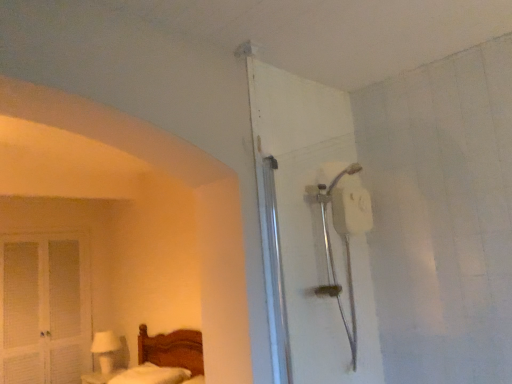
Question: From the image's perspective, is white louvered screen door at left positioned above or below white glossy table lamp at lower left?

Choices:
 (A) above
 (B) below

Answer: (A)

Question: Is point [72, 347] positioned closer to the camera than point [117, 337]?

Choices:
 (A) closer
 (B) farther

Answer: (A)

Question: Considering the real-world distances, which object is farthest from the white matte shower head at upper right?

Choices:
 (A) white louvered screen door at left
 (B) white glossy table lamp at lower left
 (C) white fluffy mattress at lower left

Answer: (B)

Question: Considering the real-world distances, which object is farthest from the white louvered screen door at left?

Choices:
 (A) white glossy table lamp at lower left
 (B) white matte shower head at upper right
 (C) white fluffy mattress at lower left

Answer: (B)